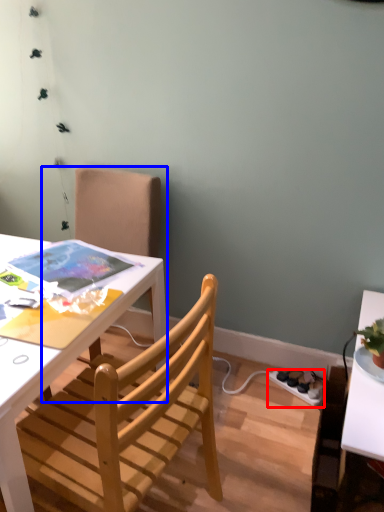
Question: Which object appears farthest to the camera in this image, power outlet (highlighted by a red box) or chair (highlighted by a blue box)?

Choices:
 (A) power outlet
 (B) chair

Answer: (A)